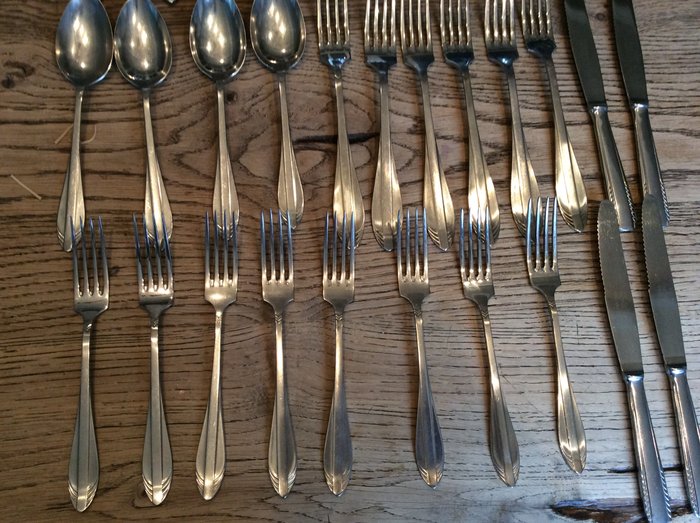
Image resolution: width=700 pixels, height=523 pixels. Identify the location of knives. (610, 277), (659, 262), (626, 63), (578, 52).